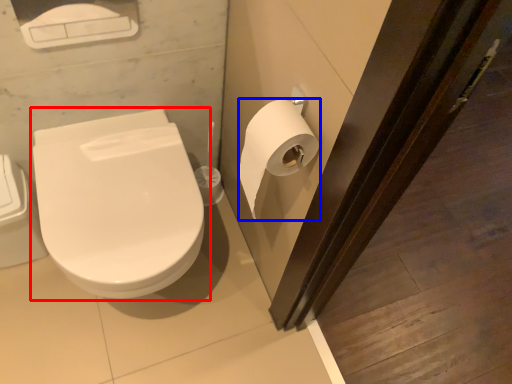
Question: Which object is further to the camera taking this photo, toilet (highlighted by a red box) or toilet paper (highlighted by a blue box)?

Choices:
 (A) toilet
 (B) toilet paper

Answer: (A)